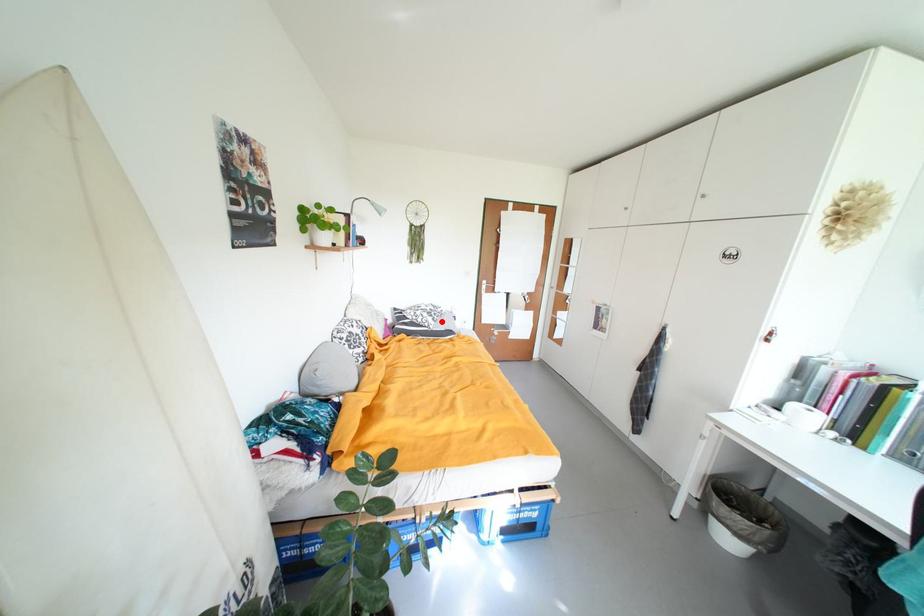
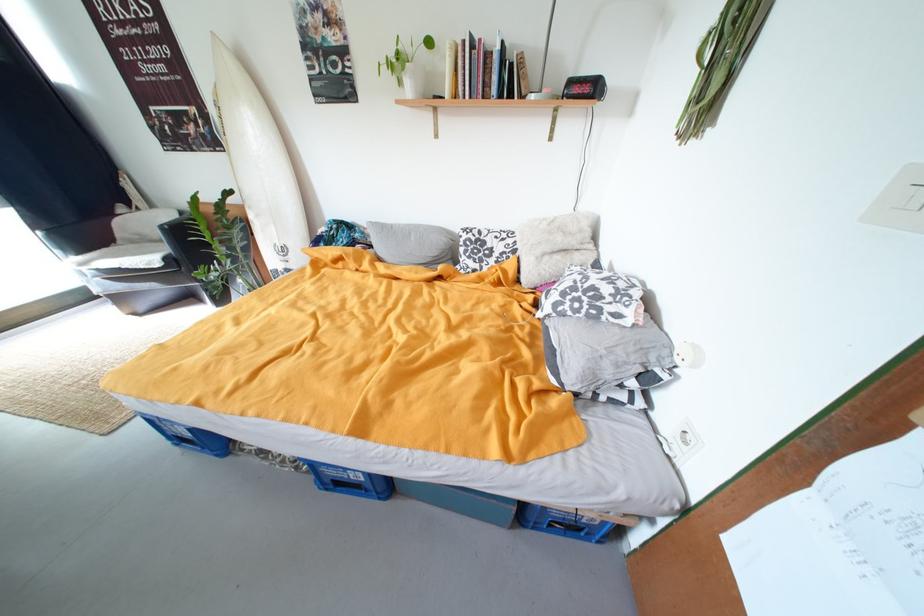
Question: I am providing you with two images of the same scene from different viewpoints. Given a red point in image1, look at the same physical point in image2. Is it:

Choices:
 (A) Closer to the viewpoint
 (B) Farther from the viewpoint

Answer: (A)